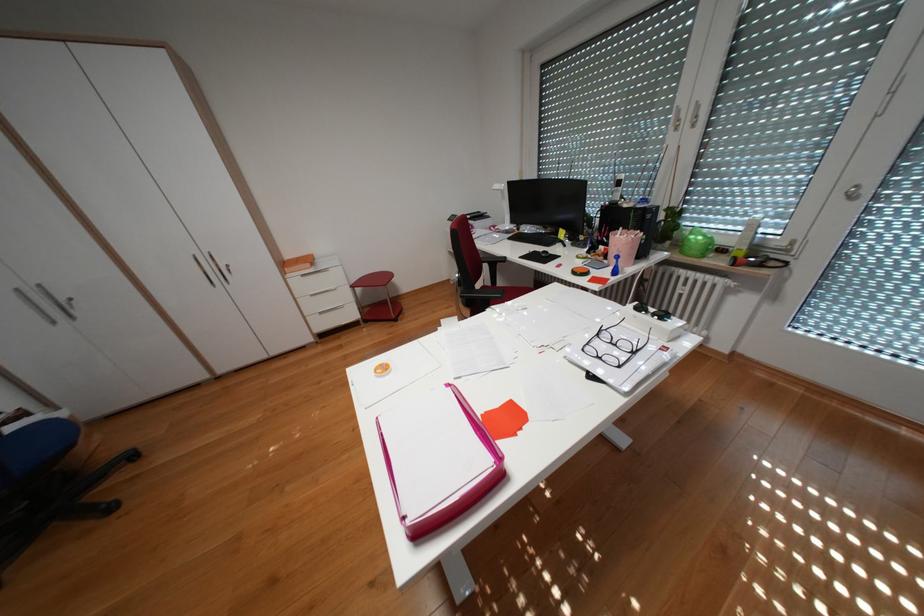
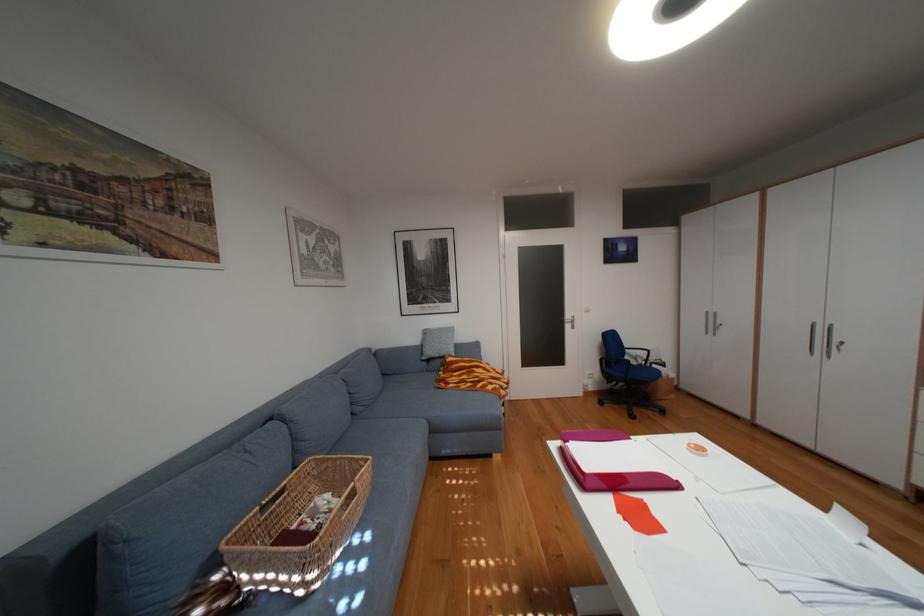
Find the pixel in the second image that matches [417,517] in the first image.

(581, 443)